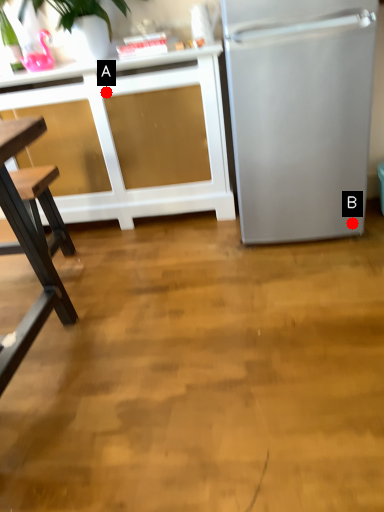
Question: Two points are circled on the image, labeled by A and B beside each circle. Which point is closer to the camera?

Choices:
 (A) A is closer
 (B) B is closer

Answer: (B)